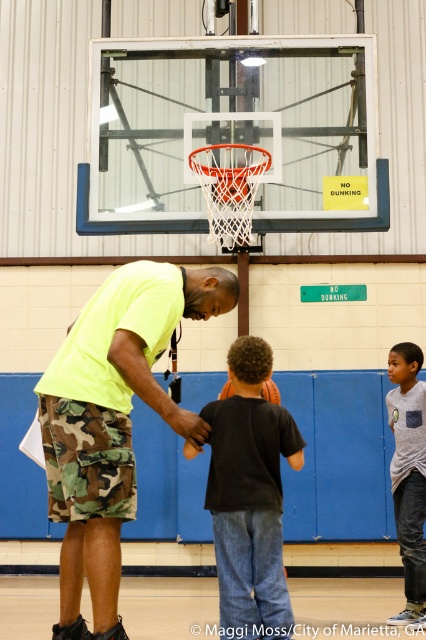
You are standing at the point with coordinates (250,497) in the gymnasium. What object are you currently standing on?

The point with coordinates (250,497) is on the black cotton shirt at center.

You are a photographer setting up for a basketball practice photo shoot. You need to position a light source between the black cotton shirt at center and the gray cotton shirt at right. Based on their heights, which shirt should the light be closer to?

The light should be closer to the black cotton shirt at center because it is shorter than the gray cotton shirt at right.

You are a referee at a basketball game. You need to ensure players maintain a minimum distance of 9 feet between them during a drill. Are the black cotton shirt at center and gray cotton shirt at right following this rule?

The distance between the black cotton shirt at center and gray cotton shirt at right is 9.15 feet, which is slightly more than the required 9 feet minimum distance. Therefore, they are following the rule.